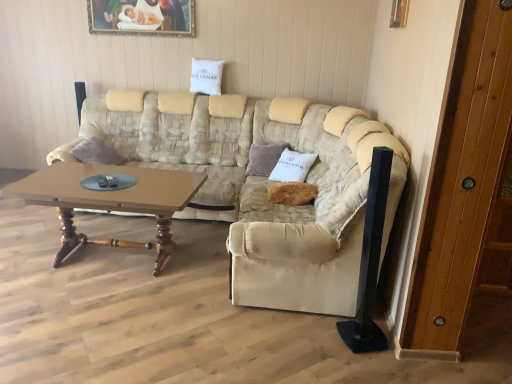
Question: Is wooden painted picture frame at upper center, acting as the 2th picture frame starting from the bottom, not within brown wooden coffee table at center?

Choices:
 (A) no
 (B) yes

Answer: (B)

Question: From a real-world perspective, is wooden painted picture frame at upper center, which is the 1th picture frame in top-to-bottom order, located beneath brown wooden coffee table at center?

Choices:
 (A) no
 (B) yes

Answer: (A)

Question: Can you confirm if wooden painted picture frame at upper center, which is the 1th picture frame in top-to-bottom order, is thinner than brown wooden coffee table at center?

Choices:
 (A) no
 (B) yes

Answer: (B)

Question: Considering the relative positions of wooden painted picture frame at upper center, which ranks as the second picture frame in front-to-back order, and brown wooden coffee table at center in the image provided, is wooden painted picture frame at upper center, which ranks as the second picture frame in front-to-back order, to the left of brown wooden coffee table at center from the viewer's perspective?

Choices:
 (A) no
 (B) yes

Answer: (B)

Question: Is wooden painted picture frame at upper center, which ranks as the second picture frame in front-to-back order, positioned behind brown wooden coffee table at center?

Choices:
 (A) yes
 (B) no

Answer: (A)

Question: Is wooden painted picture frame at upper center, which ranks as the second picture frame in front-to-back order, with brown wooden coffee table at center?

Choices:
 (A) no
 (B) yes

Answer: (A)

Question: Is white fabric pillow at upper center, which is counted as the third pillow, starting from the front, facing away from beige fabric couch at center?

Choices:
 (A) no
 (B) yes

Answer: (A)

Question: Can you confirm if white fabric pillow at upper center, the 1th pillow from the back, is taller than beige fabric couch at center?

Choices:
 (A) yes
 (B) no

Answer: (B)

Question: Considering the relative sizes of white fabric pillow at upper center, which ranks as the first pillow in top-to-bottom order, and beige fabric couch at center in the image provided, is white fabric pillow at upper center, which ranks as the first pillow in top-to-bottom order, shorter than beige fabric couch at center?

Choices:
 (A) yes
 (B) no

Answer: (A)

Question: Considering the relative positions of white fabric pillow at upper center, which ranks as the first pillow in top-to-bottom order, and beige fabric couch at center in the image provided, is white fabric pillow at upper center, which ranks as the first pillow in top-to-bottom order, in front of beige fabric couch at center?

Choices:
 (A) yes
 (B) no

Answer: (B)

Question: Is white fabric pillow at upper center, which is counted as the third pillow, starting from the front, next to beige fabric couch at center and touching it?

Choices:
 (A) yes
 (B) no

Answer: (B)

Question: Does white fabric pillow at upper center, the 1th pillow from the back, come behind beige fabric couch at center?

Choices:
 (A) yes
 (B) no

Answer: (A)

Question: Does brown wooden coffee table at center have a greater width compared to beige fabric armchair at center?

Choices:
 (A) yes
 (B) no

Answer: (B)